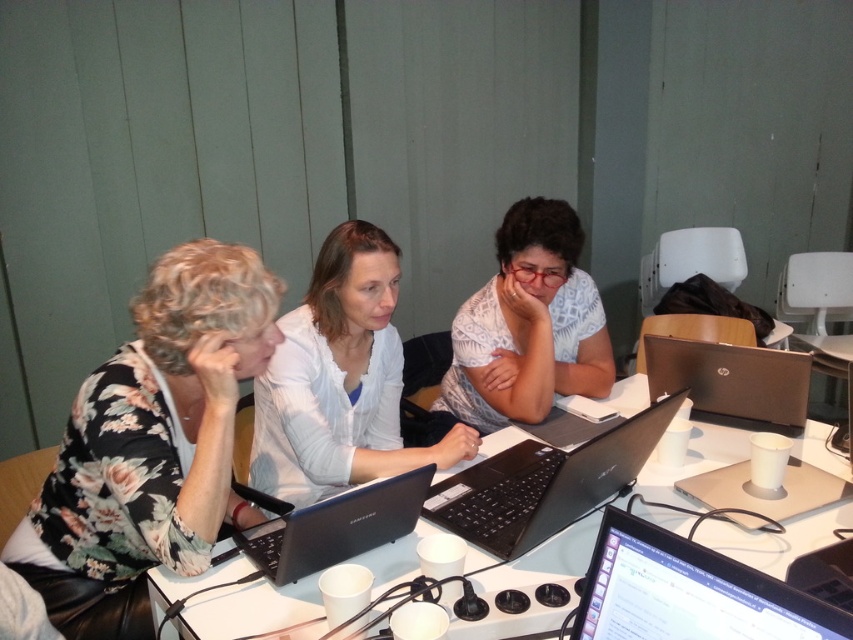
Question: Is the position of black plastic laptop at center more distant than that of black glossy laptop at center?

Choices:
 (A) no
 (B) yes

Answer: (B)

Question: Is floral fabric blouse at left smaller than black glossy laptop at center?

Choices:
 (A) yes
 (B) no

Answer: (B)

Question: Among these objects, which one is farthest from the camera?

Choices:
 (A) floral fabric blouse at center
 (B) white plastic table at center

Answer: (A)

Question: Does floral fabric blouse at center lie in front of silver metallic laptop at right?

Choices:
 (A) no
 (B) yes

Answer: (B)

Question: Among these points, which one is nearest to the camera?

Choices:
 (A) (311, 348)
 (B) (764, 628)

Answer: (B)

Question: Which point is closer to the camera taking this photo?

Choices:
 (A) (279, 384)
 (B) (529, 570)

Answer: (B)